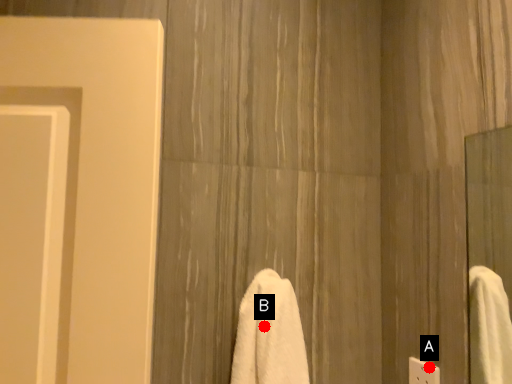
Question: Two points are circled on the image, labeled by A and B beside each circle. Among these points, which one is nearest to the camera?

Choices:
 (A) A is closer
 (B) B is closer

Answer: (B)